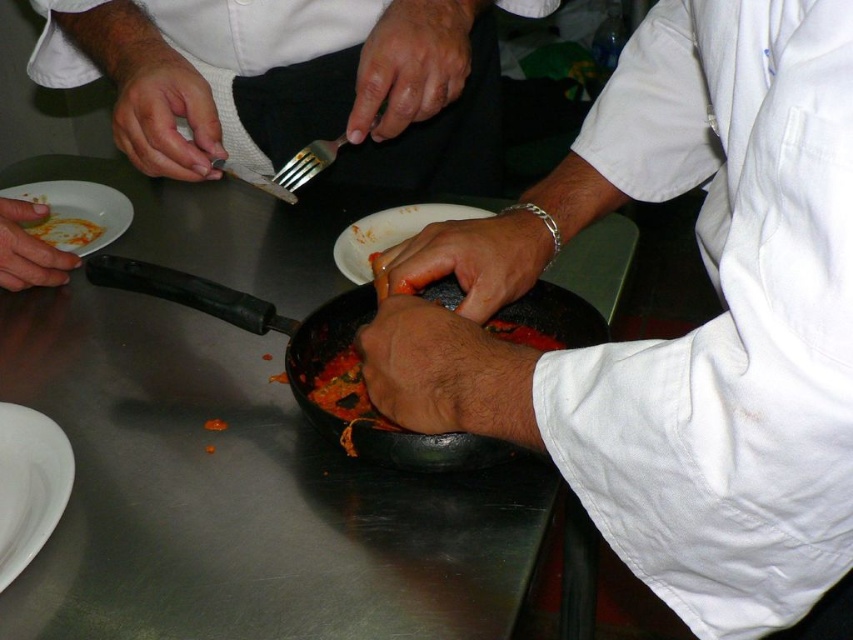
You are a food critic who just arrived at the restaurant and need to taste the dish. The chef offers you the smooth black fork at center and the white matte plate at lower left. Based on their sizes, which one is more suitable for tasting the sauce from the pan?

The smooth black fork at center is much taller than the white matte plate at lower left, so it is more suitable for tasting the sauce from the pan because its height allows better access to the sauce in the pan.

You are a chef standing in front of the smooth black pan at center. You need to reach into the pan to stir the contents. Considering your arm length is 24 inches, will you be able to comfortably reach into the pan without moving closer?

The smooth black pan at center is 11.51 inches away from the camera. Since your arm length is 24 inches, which is longer than the distance, you can comfortably reach into the pan without needing to move closer.

You are a food photographer who needs to capture the perfect shot of the dish. The smooth black fork at center and the white matte plate at lower left are crucial elements. Given their distance apart, can you position your camera so that both items are in frame without moving them?

The smooth black fork at center is 15.48 inches away from the white matte plate at lower left. Since 15.48 inches is a manageable distance for a food photographer to capture both items in frame without moving them, yes, you can position your camera appropriately to include both the smooth black fork at center and the white matte plate at lower left in the shot.